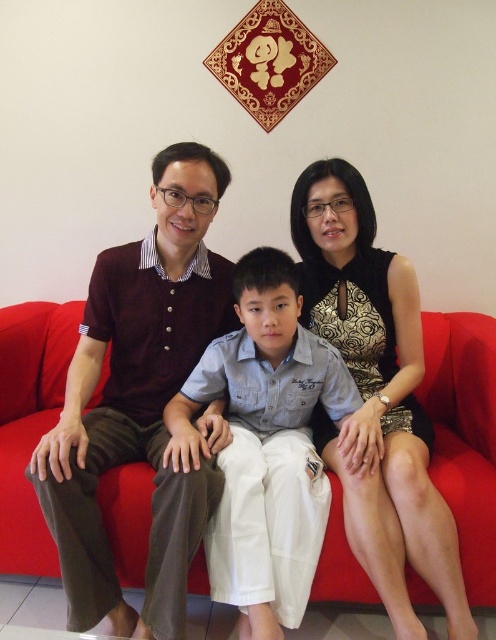
Question: Which point is farther to the camera?

Choices:
 (A) black textured dress at center
 (B) red fabric couch at center
 (C) light blue cotton shirt at center

Answer: (B)

Question: Does maroon knitwear at center appear on the right side of light blue cotton shirt at center?

Choices:
 (A) no
 (B) yes

Answer: (A)

Question: Does black textured dress at center appear on the right side of light blue cotton shirt at center?

Choices:
 (A) no
 (B) yes

Answer: (B)

Question: Estimate the real-world distances between objects in this image. Which object is closer to the black textured dress at center?

Choices:
 (A) red fabric couch at center
 (B) light blue cotton shirt at center

Answer: (B)

Question: Is red fabric couch at center closer to the viewer compared to light blue cotton shirt at center?

Choices:
 (A) yes
 (B) no

Answer: (B)

Question: Which point appears farthest from the camera in this image?

Choices:
 (A) (37, 500)
 (B) (123, 346)
 (C) (402, 316)
 (D) (303, 486)

Answer: (C)